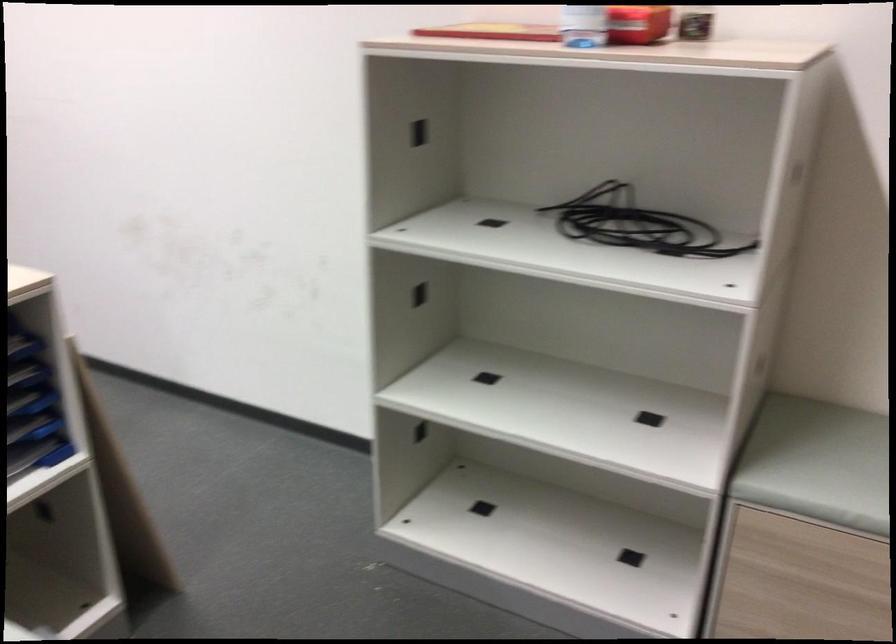
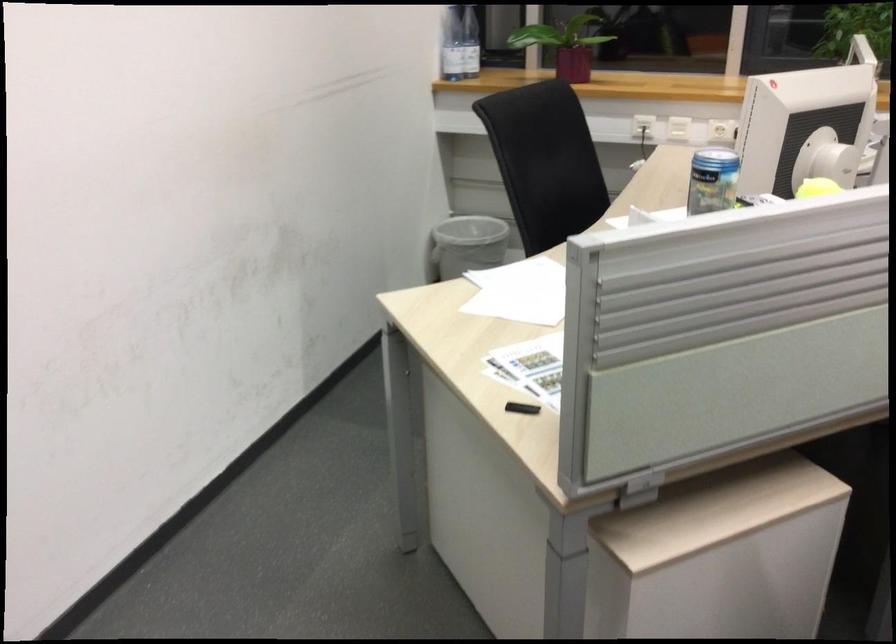
Based on the photo, based on the continuous images, in which direction is the camera rotating?

The camera rotated toward left-down.